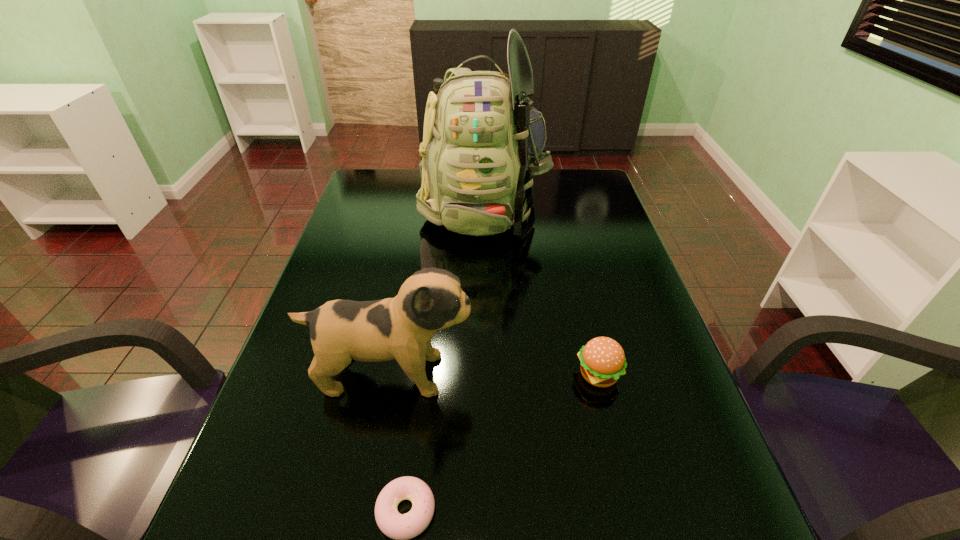
You are a GUI agent. You are given a task and a screenshot of the screen. Output one action in this format:
    pyautogui.click(x=<x>, y=<y>)
    Task: Click on the free space at the far edge of the desktop
    The image size is (960, 540).
    Given the screenshot: What is the action you would take?
    pyautogui.click(x=415, y=200)

You are a GUI agent. You are given a task and a screenshot of the screen. Output one action in this format:
    pyautogui.click(x=<x>, y=<y>)
    Task: Click on the blank area at the left edge
    
    Given the screenshot: What is the action you would take?
    pyautogui.click(x=372, y=248)

In order to click on vacant point at the right edge in this screenshot , I will do `click(708, 504)`.

This screenshot has height=540, width=960. I want to click on free space at the far left corner of the desktop, so [385, 199].

In the image, there is a desktop. Where is `vacant area at the far right corner`? vacant area at the far right corner is located at coordinates (569, 198).

I want to click on vacant region between the tallest object and the hamburger, so click(540, 292).

This screenshot has height=540, width=960. I want to click on vacant area between the third tallest object and the tallest object, so click(540, 292).

At what (x,y) coordinates should I click in order to perform the action: click on free space between the third tallest object and the tallest object. Please return your answer as a coordinate pair (x, y). Looking at the image, I should click on (540, 292).

Locate an element on the screen. Image resolution: width=960 pixels, height=540 pixels. free spot between the puppy and the second shortest object is located at coordinates (495, 374).

The width and height of the screenshot is (960, 540). Find the location of `object identified as the third closest to the second tallest object`. object identified as the third closest to the second tallest object is located at coordinates (482, 142).